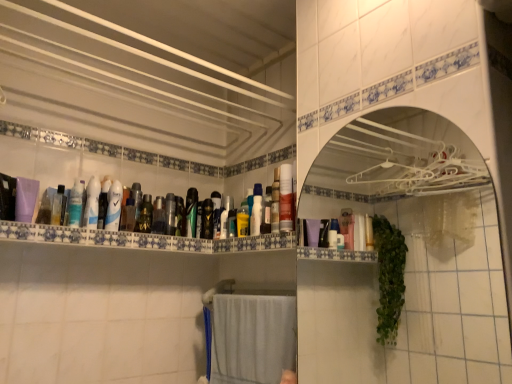
Question: From a real-world perspective, is green glossy mouthwash at center, which appears as the ninth mouthwash when viewed from the left, below metallic silver mouthwash at center, the 7th mouthwash viewed from the right?

Choices:
 (A) no
 (B) yes

Answer: (B)

Question: Is the depth of green glossy mouthwash at center, which appears as the ninth mouthwash when viewed from the left, greater than that of metallic silver mouthwash at center, acting as the 8th mouthwash starting from the left?

Choices:
 (A) no
 (B) yes

Answer: (B)

Question: Considering the relative sizes of green glossy mouthwash at center, which is the sixth mouthwash in right-to-left order, and metallic silver mouthwash at center, the 7th mouthwash viewed from the right, in the image provided, is green glossy mouthwash at center, which is the sixth mouthwash in right-to-left order, shorter than metallic silver mouthwash at center, the 7th mouthwash viewed from the right,?

Choices:
 (A) no
 (B) yes

Answer: (A)

Question: Is green glossy mouthwash at center, which is the sixth mouthwash in right-to-left order, at the left side of metallic silver mouthwash at center, the 7th mouthwash viewed from the right?

Choices:
 (A) no
 (B) yes

Answer: (A)

Question: Is green glossy mouthwash at center, which is the sixth mouthwash in right-to-left order, positioned before metallic silver mouthwash at center, the 7th mouthwash viewed from the right?

Choices:
 (A) no
 (B) yes

Answer: (A)

Question: Looking at their shapes, would you say metallic green mouthwash at center, the fourth mouthwash when ordered from right to left, is wider or thinner than translucent plastic mouthwash at upper left, the 14th mouthwash viewed from the right?

Choices:
 (A) wide
 (B) thin

Answer: (A)

Question: From a real-world perspective, relative to translucent plastic mouthwash at upper left, the first mouthwash positioned from the left, is metallic green mouthwash at center, the fourth mouthwash when ordered from right to left, vertically above or below?

Choices:
 (A) above
 (B) below

Answer: (A)

Question: From the image's perspective, is metallic green mouthwash at center, marked as the 11th mouthwash in a left-to-right arrangement, above or below translucent plastic mouthwash at upper left, the 14th mouthwash viewed from the right?

Choices:
 (A) above
 (B) below

Answer: (B)

Question: Considering the positions of metallic green mouthwash at center, the fourth mouthwash when ordered from right to left, and translucent plastic mouthwash at upper left, the 14th mouthwash viewed from the right, in the image, is metallic green mouthwash at center, the fourth mouthwash when ordered from right to left, taller or shorter than translucent plastic mouthwash at upper left, the 14th mouthwash viewed from the right,?

Choices:
 (A) short
 (B) tall

Answer: (B)

Question: In the image, is translucent plastic mouthwash at center, the 11th mouthwash viewed from the right, on the left side or the right side of translucent plastic mouthwash at center, arranged as the tenth mouthwash when viewed from the right?

Choices:
 (A) left
 (B) right

Answer: (A)

Question: Considering the positions of point (112, 185) and point (130, 206), is point (112, 185) closer or farther from the camera than point (130, 206)?

Choices:
 (A) farther
 (B) closer

Answer: (B)

Question: Looking at their shapes, would you say translucent plastic mouthwash at center, the 11th mouthwash viewed from the right, is wider or thinner than translucent plastic mouthwash at center, which is the fifth mouthwash in left-to-right order?

Choices:
 (A) thin
 (B) wide

Answer: (B)

Question: Considering the positions of translucent plastic mouthwash at center, the 11th mouthwash viewed from the right, and translucent plastic mouthwash at center, arranged as the tenth mouthwash when viewed from the right, in the image, is translucent plastic mouthwash at center, the 11th mouthwash viewed from the right, taller or shorter than translucent plastic mouthwash at center, arranged as the tenth mouthwash when viewed from the right,?

Choices:
 (A) short
 (B) tall

Answer: (B)

Question: Considering the positions of translucent plastic bottles at upper center and yellow matte bottle at center, placed as the thirteenth mouthwash when sorted from left to right, in the image, is translucent plastic bottles at upper center taller or shorter than yellow matte bottle at center, placed as the thirteenth mouthwash when sorted from left to right,?

Choices:
 (A) short
 (B) tall

Answer: (A)

Question: Does point pyautogui.click(x=154, y=248) appear closer or farther from the camera than point pyautogui.click(x=239, y=210)?

Choices:
 (A) farther
 (B) closer

Answer: (B)